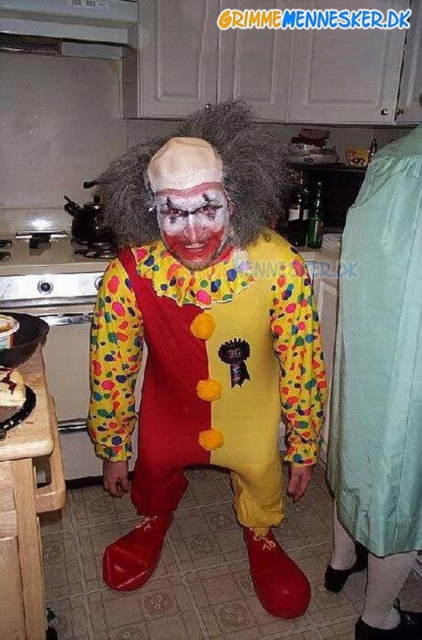
Does matte yellow clown suit at center lie behind fuzzy brown wig at center?

No, it is not.

Where is `matte yellow clown suit at center`? matte yellow clown suit at center is located at coordinates (205, 352).

Where is `matte yellow clown suit at center`? The height and width of the screenshot is (640, 422). matte yellow clown suit at center is located at coordinates (205, 352).

Describe the element at coordinates (205, 352) in the screenshot. I see `matte yellow clown suit at center` at that location.

Between matte yellow clown suit at center and light blue fabric at right, which one has less height?

light blue fabric at right is shorter.

Locate an element on the screen. matte yellow clown suit at center is located at coordinates (205, 352).

At what (x,y) coordinates should I click in order to perform the action: click on matte yellow clown suit at center. Please return your answer as a coordinate pair (x, y). Looking at the image, I should click on (205, 352).

Does fuzzy brown wig at center have a lesser width compared to matte clown face at center?

Incorrect, fuzzy brown wig at center's width is not less than matte clown face at center's.

Between point (145, 170) and point (191, 225), which one is positioned in front?

Positioned in front is point (191, 225).

Describe the element at coordinates (222, 176) in the screenshot. The height and width of the screenshot is (640, 422). I see `fuzzy brown wig at center` at that location.

Where is `fuzzy brown wig at center`? The height and width of the screenshot is (640, 422). fuzzy brown wig at center is located at coordinates (222, 176).